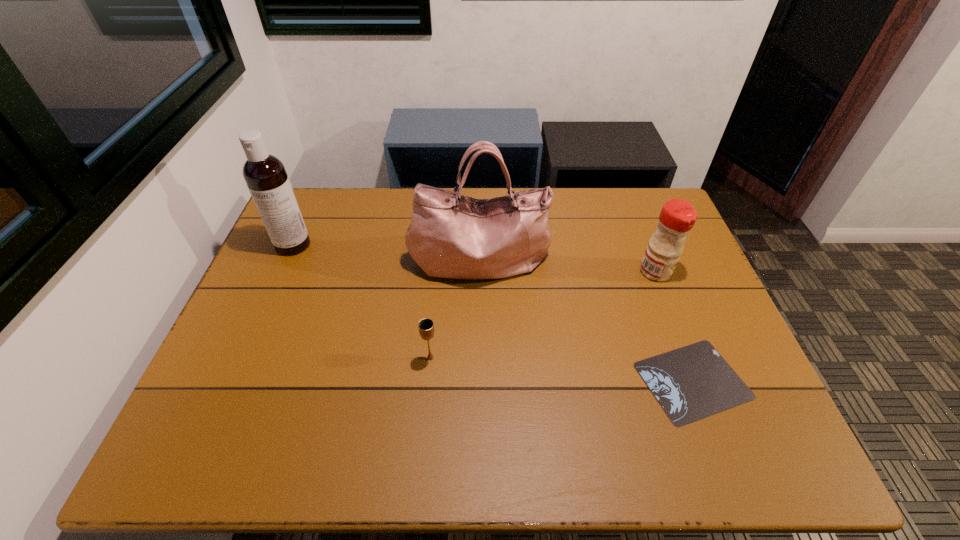
You are a GUI agent. You are given a task and a screenshot of the screen. Output one action in this format:
    pyautogui.click(x=<x>, y=<y>)
    Task: Click on the object situated at the left edge
    This screenshot has height=540, width=960.
    Given the screenshot: What is the action you would take?
    pyautogui.click(x=265, y=175)

Identify the location of condiment that is at the right edge. (677, 217).

Identify the location of mousepad that is positioned at the right edge. (693, 382).

You are a GUI agent. You are given a task and a screenshot of the screen. Output one action in this format:
    pyautogui.click(x=<x>, y=<y>)
    Task: Click on the free region at the far edge
    Image resolution: width=960 pixels, height=540 pixels.
    Given the screenshot: What is the action you would take?
    [410, 194]

In the image, there is a desktop. Identify the location of free region at the near edge. This screenshot has height=540, width=960. (658, 457).

This screenshot has height=540, width=960. I want to click on vacant region at the left edge of the desktop, so click(242, 344).

Find the location of a particular element. The width and height of the screenshot is (960, 540). free space at the near left corner of the desktop is located at coordinates (206, 437).

Identify the location of empty space between the handbag and the shortest object. (587, 320).

This screenshot has width=960, height=540. Find the location of `empty space between the shortest object and the leftmost object`. empty space between the shortest object and the leftmost object is located at coordinates (493, 313).

You are a GUI agent. You are given a task and a screenshot of the screen. Output one action in this format:
    pyautogui.click(x=<x>, y=<y>)
    Task: Click on the vacant area that lies between the condiment and the fourth tallest object
    
    Given the screenshot: What is the action you would take?
    pyautogui.click(x=543, y=315)